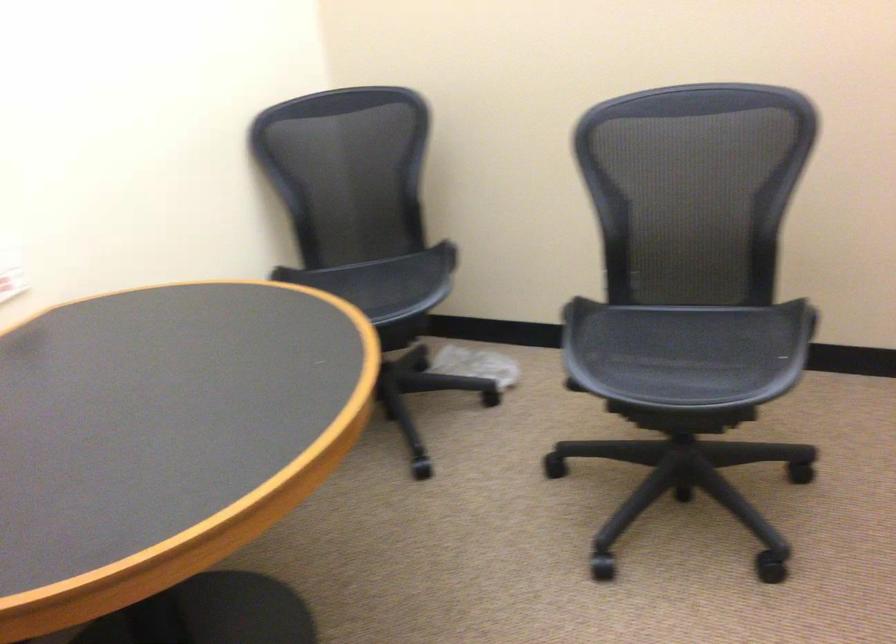
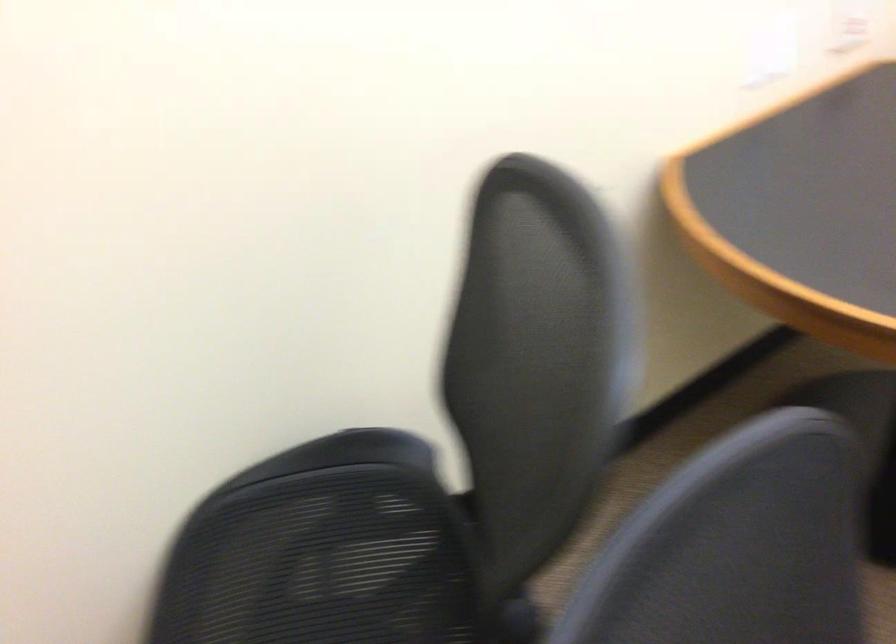
Question: The images are taken continuously from a first-person perspective. In which direction is your viewpoint rotating?

Choices:
 (A) Left
 (B) Right
 (C) Up
 (D) Down

Answer: (A)